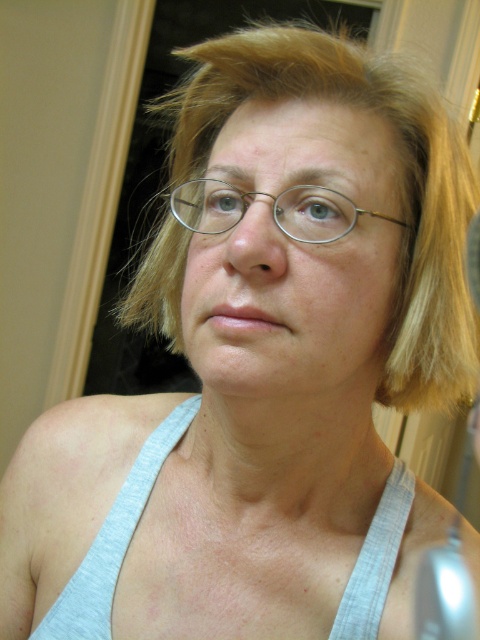
Question: Which object is positioned farthest from the metallic wireframe glasses at center?

Choices:
 (A) gray fabric vest at center
 (B) matte silver glasses at center

Answer: (A)

Question: Is matte silver glasses at center further to the viewer compared to gray fabric vest at center?

Choices:
 (A) yes
 (B) no

Answer: (B)

Question: Is matte silver glasses at center positioned in front of metallic wireframe glasses at center?

Choices:
 (A) no
 (B) yes

Answer: (B)

Question: Among these objects, which one is farthest from the camera?

Choices:
 (A) metallic wireframe glasses at center
 (B) gray fabric vest at center
 (C) matte silver glasses at center

Answer: (B)

Question: Can you confirm if matte silver glasses at center is positioned to the right of metallic wireframe glasses at center?

Choices:
 (A) yes
 (B) no

Answer: (B)

Question: Which point is closer to the camera taking this photo?

Choices:
 (A) (182, 294)
 (B) (238, 193)
 (C) (383, 536)

Answer: (B)